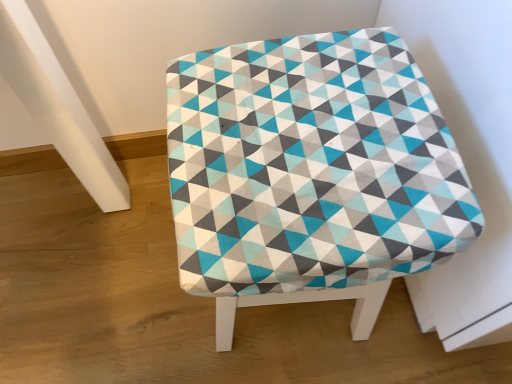
Find the location of a particular element. The image size is (512, 384). teal-patterned fabric stool at center is located at coordinates (311, 173).

Describe the element at coordinates (311, 173) in the screenshot. The width and height of the screenshot is (512, 384). I see `teal-patterned fabric stool at center` at that location.

Where is `teal-patterned fabric stool at center`? The width and height of the screenshot is (512, 384). teal-patterned fabric stool at center is located at coordinates (311, 173).